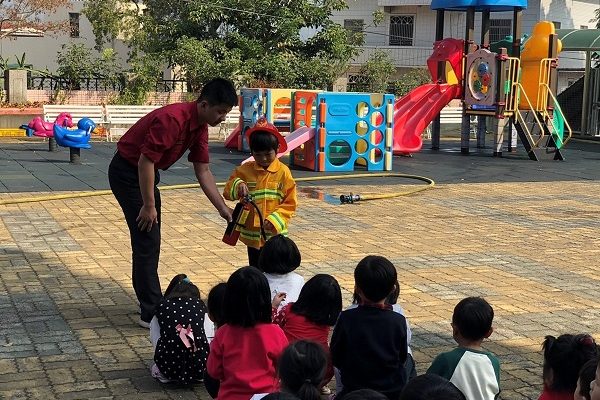
Find the location of `wall`. wall is located at coordinates (77, 92).